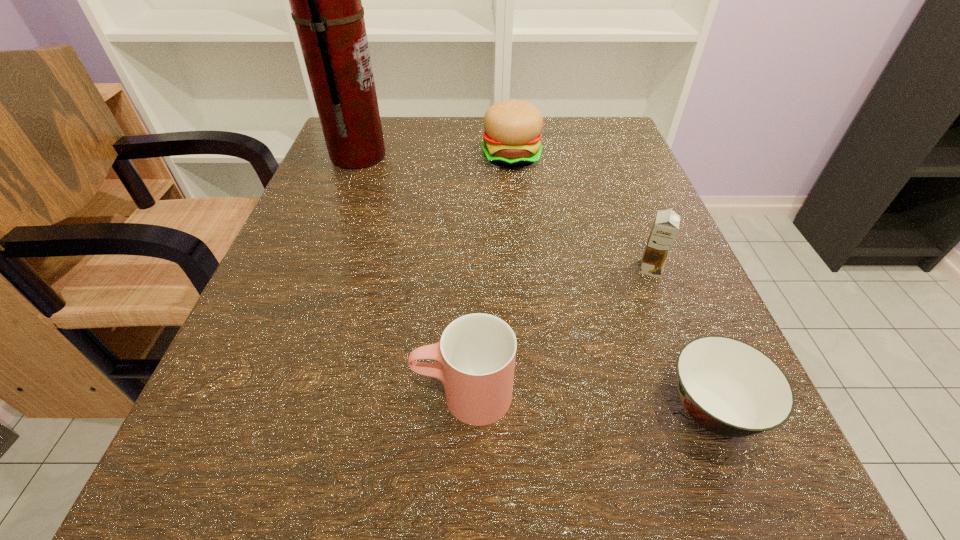
In order to click on vacant region between the tallest object and the hamburger in this screenshot , I will do `click(435, 157)`.

At what (x,y) coordinates should I click in order to perform the action: click on free space between the soup bowl and the hamburger. Please return your answer as a coordinate pair (x, y). The height and width of the screenshot is (540, 960). Looking at the image, I should click on (612, 284).

The image size is (960, 540). Identify the location of free space between the third nearest object and the cup. (557, 332).

Identify the location of vacant space that is in between the tallest object and the cup. The image size is (960, 540). (411, 275).

The image size is (960, 540). Identify the location of unoccupied position between the soup bowl and the leftmost object. (x=535, y=283).

At what (x,y) coordinates should I click in order to perform the action: click on free space between the cup and the hamburger. Please return your answer as a coordinate pair (x, y). This screenshot has width=960, height=540. Looking at the image, I should click on (488, 276).

This screenshot has width=960, height=540. Identify the location of blank region between the hamburger and the third farthest object. point(581,213).

This screenshot has height=540, width=960. Identify the location of object that stands as the closest to the shortest object. (666, 225).

Select which object appears as the third closest to the chocolate milk. Please provide its 2D coordinates. Your answer should be formatted as a tuple, i.e. [(x, y)], where the tuple contains the x and y coordinates of a point satisfying the conditions above.

[(512, 138)]

Locate an element on the screen. This screenshot has width=960, height=540. vacant space that satisfies the following two spatial constraints: 1. on the back side of the hamburger; 2. on the side of the tallest object with the handle and hose is located at coordinates (511, 156).